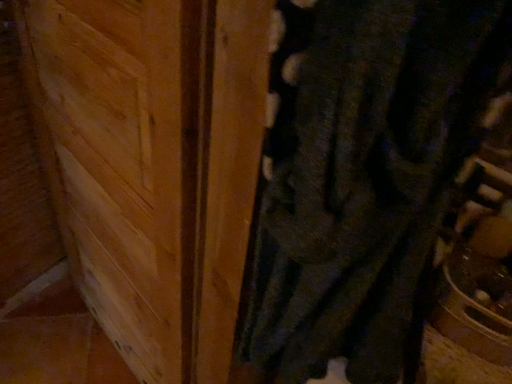
What do you see at coordinates (153, 165) in the screenshot?
I see `wooden door at center` at bounding box center [153, 165].

Find the location of `wooden door at center`. wooden door at center is located at coordinates (153, 165).

What is the approximate height of wooden door at center?

The height of wooden door at center is 1.30 meters.

What is the approximate width of wooden door at center?

The width of wooden door at center is 3.25 inches.

The height and width of the screenshot is (384, 512). I want to click on wooden door at center, so coord(153,165).